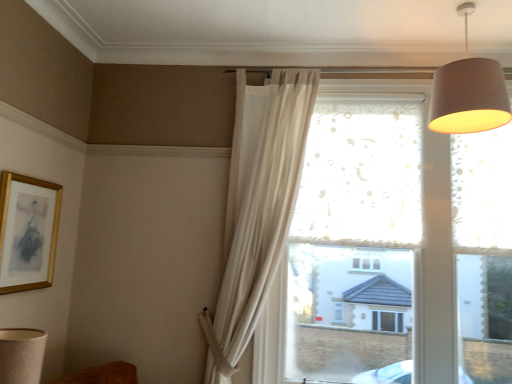
Question: Is white sheer curtain at upper center oriented away from beige fabric lampshade at lower left?

Choices:
 (A) yes
 (B) no

Answer: (B)

Question: Considering the relative sizes of white sheer curtain at upper center and beige fabric lampshade at lower left in the image provided, is white sheer curtain at upper center taller than beige fabric lampshade at lower left?

Choices:
 (A) yes
 (B) no

Answer: (A)

Question: Can you confirm if white sheer curtain at upper center is positioned to the left of beige fabric lampshade at lower left?

Choices:
 (A) yes
 (B) no

Answer: (B)

Question: Is white sheer curtain at upper center in contact with beige fabric lampshade at lower left?

Choices:
 (A) yes
 (B) no

Answer: (B)

Question: From a real-world perspective, is white sheer curtain at upper center over beige fabric lampshade at lower left?

Choices:
 (A) no
 (B) yes

Answer: (B)

Question: Would you say matte gray lampshade at upper right is inside or outside gold wooden picture frame at upper left?

Choices:
 (A) outside
 (B) inside

Answer: (A)

Question: From the image's perspective, is matte gray lampshade at upper right above or below gold wooden picture frame at upper left?

Choices:
 (A) above
 (B) below

Answer: (A)

Question: Looking at their shapes, would you say matte gray lampshade at upper right is wider or thinner than gold wooden picture frame at upper left?

Choices:
 (A) wide
 (B) thin

Answer: (A)

Question: From a real-world perspective, is matte gray lampshade at upper right physically located above or below gold wooden picture frame at upper left?

Choices:
 (A) above
 (B) below

Answer: (A)

Question: From their relative heights in the image, would you say white sheer curtain at upper center is taller or shorter than frosted glass window at center?

Choices:
 (A) tall
 (B) short

Answer: (B)

Question: Is white sheer curtain at upper center inside or outside of frosted glass window at center?

Choices:
 (A) inside
 (B) outside

Answer: (B)

Question: Considering the positions of point click(x=251, y=165) and point click(x=259, y=301), is point click(x=251, y=165) closer or farther from the camera than point click(x=259, y=301)?

Choices:
 (A) farther
 (B) closer

Answer: (A)

Question: From a real-world perspective, is white sheer curtain at upper center above or below frosted glass window at center?

Choices:
 (A) above
 (B) below

Answer: (A)

Question: Considering the positions of point click(22, 192) and point click(6, 344), is point click(22, 192) closer or farther from the camera than point click(6, 344)?

Choices:
 (A) closer
 (B) farther

Answer: (B)

Question: In the image, is gold wooden picture frame at upper left positioned in front of or behind beige fabric lampshade at lower left?

Choices:
 (A) front
 (B) behind

Answer: (B)